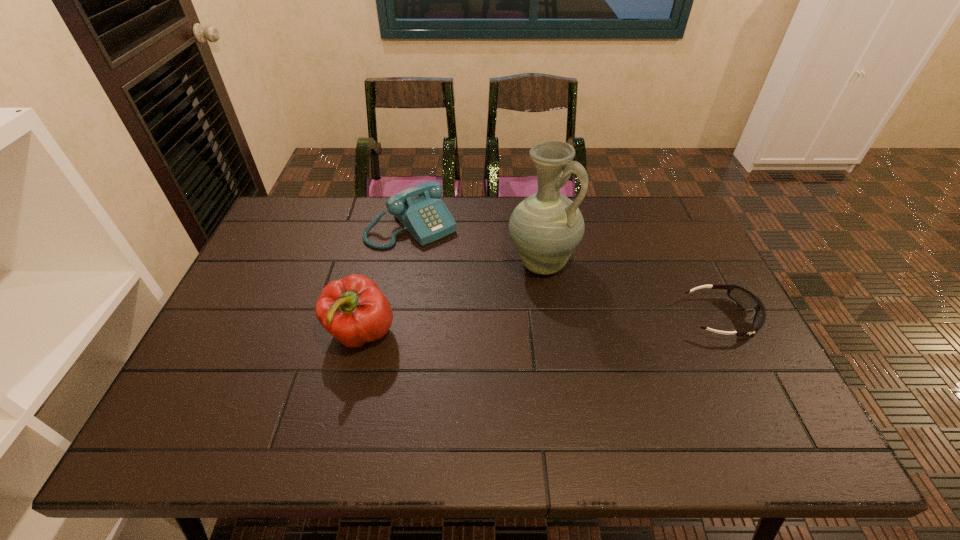
The width and height of the screenshot is (960, 540). In order to click on free space located on the dial of the third tallest object in this screenshot , I will do `click(466, 276)`.

The image size is (960, 540). In order to click on vacant region located 0.080m on the dial of the third tallest object in this screenshot , I will do `click(449, 259)`.

This screenshot has height=540, width=960. Identify the location of free space located on the dial of the third tallest object. (473, 284).

Identify the location of object at the far edge. Image resolution: width=960 pixels, height=540 pixels. (419, 209).

At what (x,y) coordinates should I click in order to perform the action: click on object located in the right edge section of the desktop. Please return your answer as a coordinate pair (x, y). The height and width of the screenshot is (540, 960). Looking at the image, I should click on 744,298.

The width and height of the screenshot is (960, 540). In the image, there is a desktop. What are the coordinates of `vacant space at the far edge` in the screenshot? It's located at (593, 219).

The height and width of the screenshot is (540, 960). I want to click on blank space at the near edge, so click(x=707, y=395).

This screenshot has width=960, height=540. What are the coordinates of `vacant region at the left edge of the desktop` in the screenshot? It's located at tap(233, 292).

In the image, there is a desktop. Where is `vacant space at the right edge`? This screenshot has width=960, height=540. vacant space at the right edge is located at coordinates (688, 253).

In the image, there is a desktop. What are the coordinates of `vacant area at the far left corner` in the screenshot? It's located at (x=290, y=233).